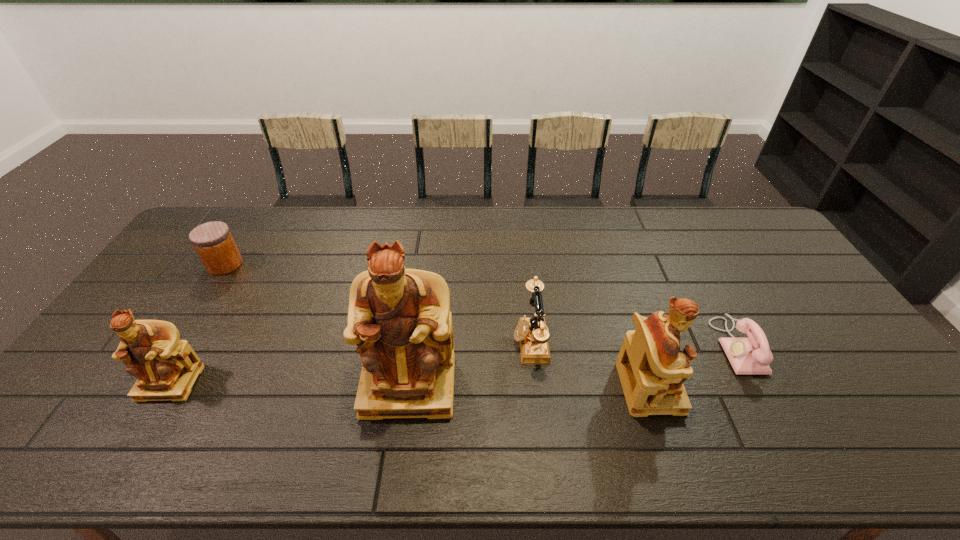
The height and width of the screenshot is (540, 960). I want to click on object that is at the left edge, so click(213, 241).

The width and height of the screenshot is (960, 540). What are the coordinates of `vacant area at the far edge` in the screenshot? It's located at (457, 208).

What are the coordinates of `vacant area at the right edge` in the screenshot? It's located at (800, 278).

In the image, there is a desktop. Identify the location of vacant space at the far right corner. (749, 220).

Identify the location of empty space between the second figurine from left to right and the fifth tallest object. (317, 325).

You are a GUI agent. You are given a task and a screenshot of the screen. Output one action in this format:
    pyautogui.click(x=<x>, y=<y>)
    Task: Click on the free space that is in between the third tallest object and the fourth object from right to left
    This screenshot has width=960, height=540.
    Given the screenshot: What is the action you would take?
    pyautogui.click(x=290, y=383)

You are a GUI agent. You are given a task and a screenshot of the screen. Output one action in this format:
    pyautogui.click(x=<x>, y=<y>)
    Task: Click on the free space between the second figurine from right to left and the farthest object
    This screenshot has height=540, width=960.
    Given the screenshot: What is the action you would take?
    pyautogui.click(x=317, y=325)

In order to click on free space between the tallest object and the right telephone in this screenshot , I will do `click(573, 366)`.

Locate an element on the screen. The width and height of the screenshot is (960, 540). vacant space that's between the leftmost figurine and the jar is located at coordinates (198, 323).

This screenshot has height=540, width=960. Find the location of `free space that is in between the fourth object from right to left and the leftmost figurine`. free space that is in between the fourth object from right to left and the leftmost figurine is located at coordinates (290, 383).